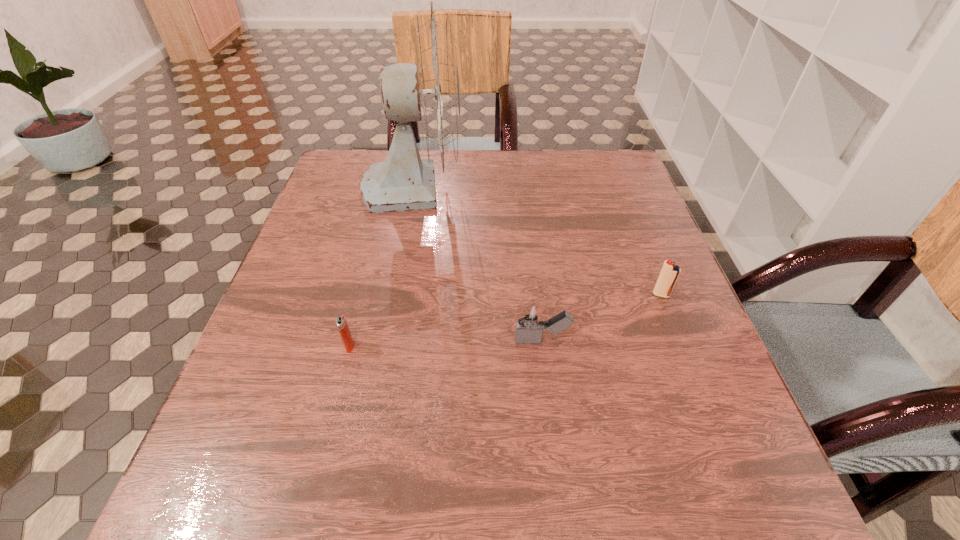
Find the location of a particular element. the tallest object is located at coordinates coord(428,91).

Image resolution: width=960 pixels, height=540 pixels. Identify the location of fan. (428, 91).

The image size is (960, 540). Find the location of `the second igniter from left to right`. the second igniter from left to right is located at coordinates (530, 322).

Where is `the rightmost igniter`? This screenshot has width=960, height=540. the rightmost igniter is located at coordinates (669, 274).

At what (x,y) coordinates should I click in order to perform the action: click on the third nearest object. Please return your answer as a coordinate pair (x, y). Looking at the image, I should click on (669, 274).

Where is `the leftmost igniter`? This screenshot has height=540, width=960. the leftmost igniter is located at coordinates (341, 322).

You are a GUI agent. You are given a task and a screenshot of the screen. Output one action in this format:
    pyautogui.click(x=<x>, y=<y>)
    Task: Click on the free space located 0.240m in front of the farthest object to blow air
    This screenshot has height=540, width=960.
    Given the screenshot: What is the action you would take?
    pyautogui.click(x=555, y=186)

The image size is (960, 540). In order to click on vacant space located 0.130m on the back of the second object from right to left in this screenshot , I will do `click(535, 280)`.

The width and height of the screenshot is (960, 540). I want to click on vacant space situated on the back of the rightmost object, so click(625, 204).

This screenshot has height=540, width=960. Find the location of `vacant point located on the back of the leftmost igniter`. vacant point located on the back of the leftmost igniter is located at coordinates (382, 220).